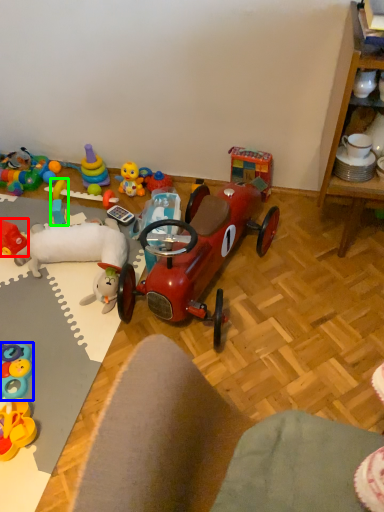
Question: Which object is the farthest from toy (highlighted by a red box)? Choose among these: toy (highlighted by a blue box) or toy (highlighted by a green box).

Choices:
 (A) toy
 (B) toy

Answer: (A)